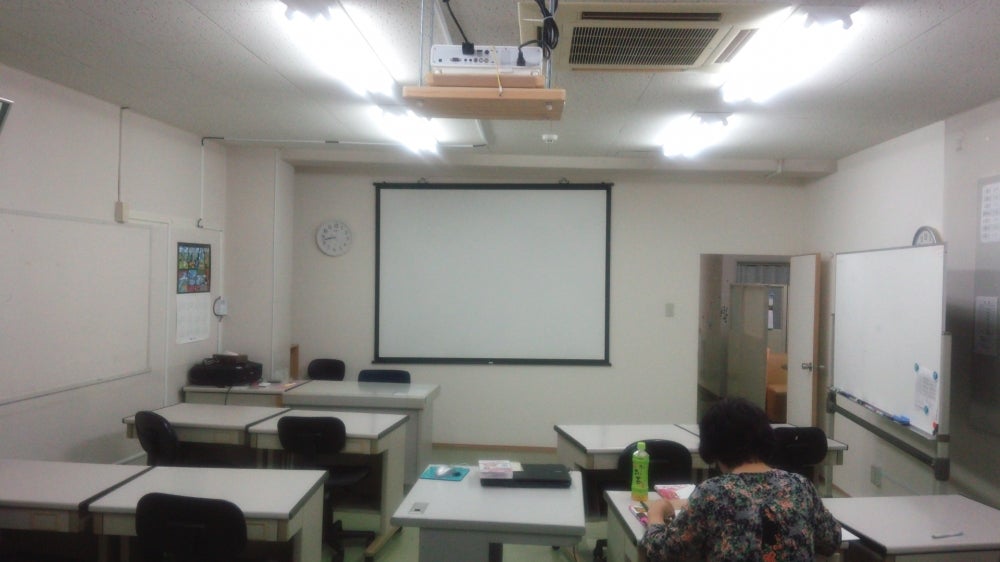
This screenshot has height=562, width=1000. I want to click on light 2, so click(x=312, y=31), click(x=342, y=30), click(x=355, y=71), click(x=339, y=60), click(x=362, y=63).